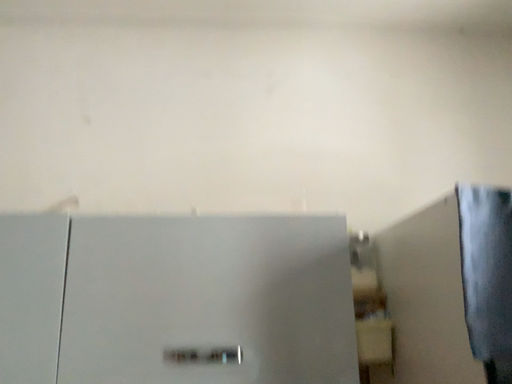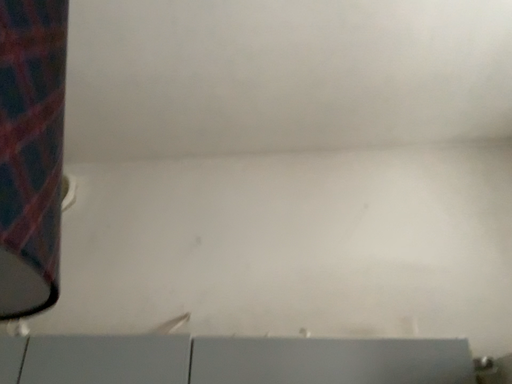
Question: How did the camera likely rotate when shooting the video?

Choices:
 (A) rotated downward
 (B) rotated upward

Answer: (B)